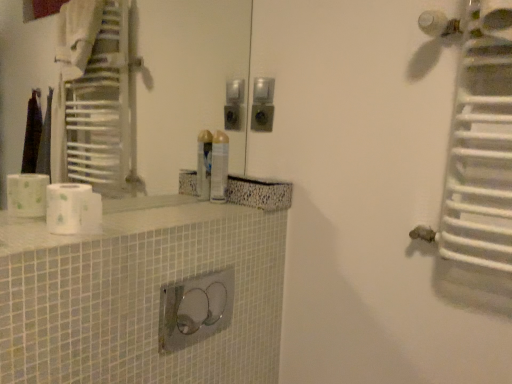
Question: From a real-world perspective, does white metallic radiator at upper right sit lower than white glossy counter top at center?

Choices:
 (A) no
 (B) yes

Answer: (A)

Question: From the image's perspective, does white metallic radiator at upper right appear lower than white glossy counter top at center?

Choices:
 (A) yes
 (B) no

Answer: (B)

Question: Does white metallic radiator at upper right touch white glossy counter top at center?

Choices:
 (A) no
 (B) yes

Answer: (A)

Question: Considering the relative sizes of white metallic radiator at upper right and white glossy counter top at center in the image provided, is white metallic radiator at upper right taller than white glossy counter top at center?

Choices:
 (A) yes
 (B) no

Answer: (A)

Question: Is white metallic radiator at upper right to the left of white glossy counter top at center from the viewer's perspective?

Choices:
 (A) yes
 (B) no

Answer: (B)

Question: Is white metallic radiator at upper right behind white glossy counter top at center?

Choices:
 (A) yes
 (B) no

Answer: (A)

Question: Is white matte toilet paper at left outside of white glossy counter top at center?

Choices:
 (A) no
 (B) yes

Answer: (B)

Question: From the image's perspective, is white matte toilet paper at left below white glossy counter top at center?

Choices:
 (A) no
 (B) yes

Answer: (A)

Question: Is white matte toilet paper at left further to the viewer compared to white glossy counter top at center?

Choices:
 (A) no
 (B) yes

Answer: (B)

Question: From the image's perspective, is white matte toilet paper at left located above white glossy counter top at center?

Choices:
 (A) yes
 (B) no

Answer: (A)

Question: Is white matte toilet paper at left aimed at white glossy counter top at center?

Choices:
 (A) yes
 (B) no

Answer: (B)

Question: Considering the relative sizes of white matte toilet paper at left and white glossy counter top at center in the image provided, is white matte toilet paper at left wider than white glossy counter top at center?

Choices:
 (A) no
 (B) yes

Answer: (A)

Question: Considering the relative sizes of white matte toilet paper at left and metallic silver spray can at center in the image provided, is white matte toilet paper at left bigger than metallic silver spray can at center?

Choices:
 (A) yes
 (B) no

Answer: (A)